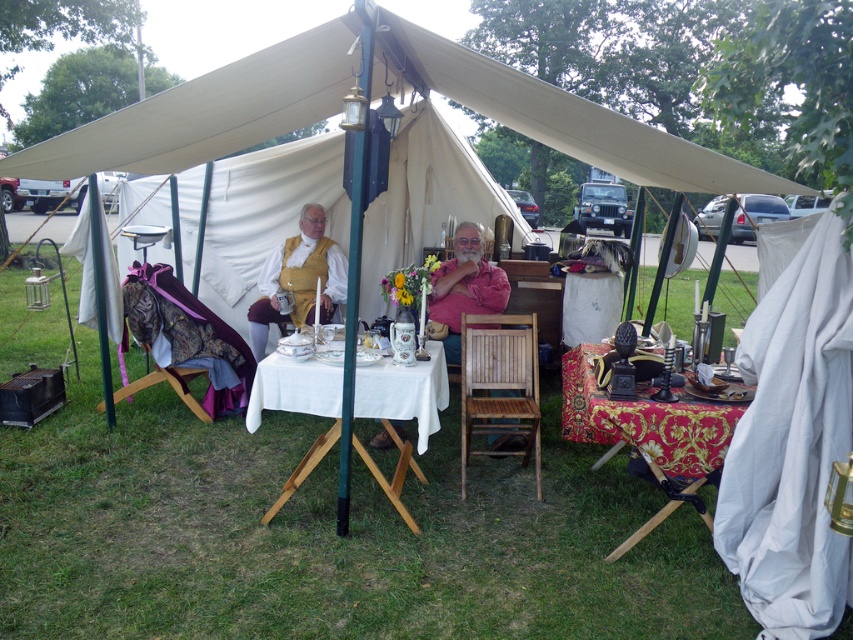
Question: Is white cloth-covered table at center below red damask tablecloth at lower right?

Choices:
 (A) yes
 (B) no

Answer: (A)

Question: Does white cloth-covered table at center lie in front of red damask tablecloth at lower right?

Choices:
 (A) no
 (B) yes

Answer: (A)

Question: Can you confirm if white cloth-covered table at center is positioned to the left of matte yellow vest at center?

Choices:
 (A) yes
 (B) no

Answer: (B)

Question: Which point is farther to the camera?

Choices:
 (A) matte yellow vest at center
 (B) white cloth-covered table at center
 (C) beige canvas canopy at upper center

Answer: (A)

Question: Which of the following is the farthest from the observer?

Choices:
 (A) (206, 112)
 (B) (381, 444)
 (C) (289, 269)
 (D) (378, 410)

Answer: (C)

Question: Among these points, which one is farthest from the camera?

Choices:
 (A) (515, 106)
 (B) (698, 444)
 (C) (265, 280)

Answer: (C)